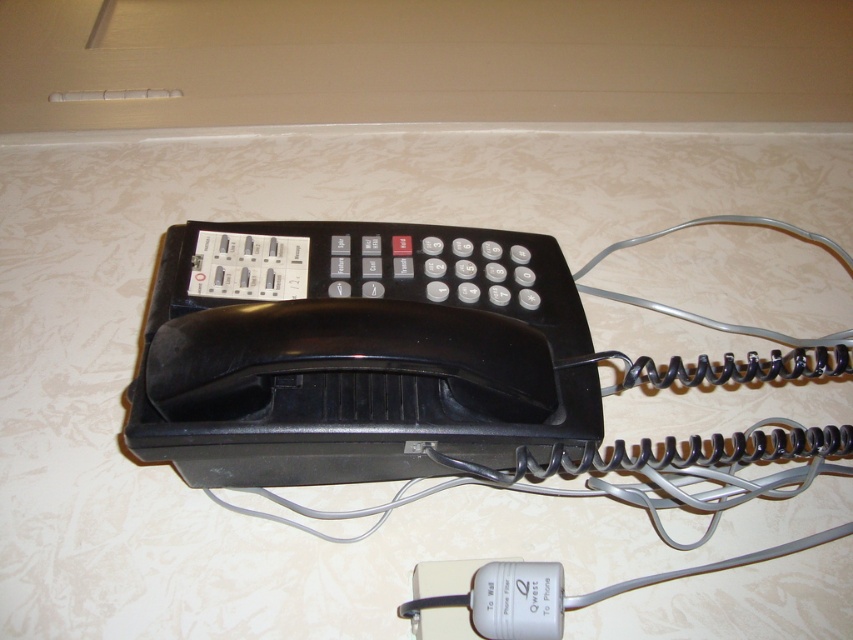
Question: Is black plastic phone at center further to camera compared to white plastic power filter at lower center?

Choices:
 (A) yes
 (B) no

Answer: (B)

Question: Does black plastic phone at center have a greater width compared to white plastic power filter at lower center?

Choices:
 (A) yes
 (B) no

Answer: (A)

Question: Which point appears farthest from the camera in this image?

Choices:
 (A) (561, 385)
 (B) (560, 625)

Answer: (A)

Question: Which object appears closest to the camera in this image?

Choices:
 (A) white plastic power filter at lower center
 (B) black plastic phone at center

Answer: (B)

Question: Can you confirm if black plastic phone at center is wider than white plastic power filter at lower center?

Choices:
 (A) no
 (B) yes

Answer: (B)

Question: Which point is farther to the camera?

Choices:
 (A) (463, 355)
 (B) (532, 588)

Answer: (B)